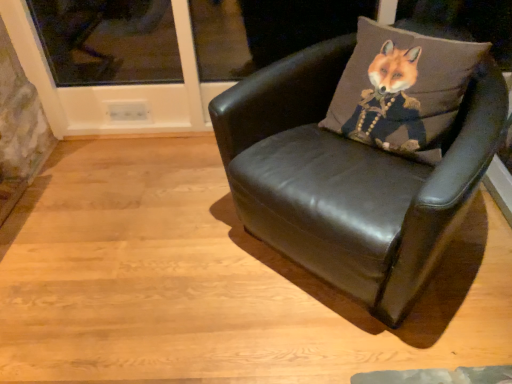
Locate an element on the screen. brown fabric fox at upper right is located at coordinates (402, 88).

The height and width of the screenshot is (384, 512). What do you see at coordinates (402, 88) in the screenshot? I see `brown fabric fox at upper right` at bounding box center [402, 88].

What is the approximate width of brown fabric fox at upper right?

brown fabric fox at upper right is 8.30 inches in width.

From the picture: What is the approximate height of black leather chair at center?

A: black leather chair at center is 27.73 inches tall.

What do you see at coordinates (349, 178) in the screenshot? The width and height of the screenshot is (512, 384). I see `black leather chair at center` at bounding box center [349, 178].

Identify the location of black leather chair at center. (349, 178).

Find the location of a particular element. The height and width of the screenshot is (384, 512). brown fabric fox at upper right is located at coordinates (402, 88).

Is brown fabric fox at upper right to the left or to the right of black leather chair at center in the image?

Clearly, brown fabric fox at upper right is on the right of black leather chair at center in the image.

Considering the positions of objects brown fabric fox at upper right and black leather chair at center in the image provided, who is behind, brown fabric fox at upper right or black leather chair at center?

brown fabric fox at upper right.

Does point (407, 148) come farther from viewer compared to point (218, 145)?

No, it is not.

From the image's perspective, between brown fabric fox at upper right and black leather chair at center, which one is located above?

brown fabric fox at upper right.

From a real-world perspective, which is physically below, brown fabric fox at upper right or black leather chair at center?

From a 3D spatial view, black leather chair at center is below.

Is brown fabric fox at upper right wider or thinner than black leather chair at center?

Clearly, brown fabric fox at upper right has less width compared to black leather chair at center.

Between brown fabric fox at upper right and black leather chair at center, which one has less height?

Standing shorter between the two is brown fabric fox at upper right.

Consider the image. Which of these two, brown fabric fox at upper right or black leather chair at center, is smaller?

brown fabric fox at upper right.

Would you say brown fabric fox at upper right is outside black leather chair at center?

No, brown fabric fox at upper right is not entirely external to black leather chair at center.

Is brown fabric fox at upper right positioned far away from black leather chair at center?

They are positioned close to each other.

Is brown fabric fox at upper right facing towards black leather chair at center?

Yes, brown fabric fox at upper right is turned towards black leather chair at center.

Locate an element on the screen. This screenshot has height=384, width=512. chair lying in front of the brown fabric fox at upper right is located at coordinates (349, 178).

Which object is positioned more to the left, black leather chair at center or brown fabric fox at upper right?

Positioned to the left is black leather chair at center.

From the picture: Relative to brown fabric fox at upper right, is black leather chair at center in front or behind?

Clearly, black leather chair at center is in front of brown fabric fox at upper right.

Does point (362, 284) appear closer or farther from the camera than point (386, 66)?

Point (362, 284) is positioned closer to the camera compared to point (386, 66).

From the image's perspective, is black leather chair at center positioned above or below brown fabric fox at upper right?

black leather chair at center is situated lower than brown fabric fox at upper right in the image.

Consider the image. From a real-world perspective, is black leather chair at center beneath brown fabric fox at upper right?

Yes.

Between black leather chair at center and brown fabric fox at upper right, which one has larger width?

With larger width is black leather chair at center.

Who is shorter, black leather chair at center or brown fabric fox at upper right?

brown fabric fox at upper right.

Considering the sizes of objects black leather chair at center and brown fabric fox at upper right in the image provided, who is bigger, black leather chair at center or brown fabric fox at upper right?

black leather chair at center.

Is brown fabric fox at upper right inside black leather chair at center?

Yes, brown fabric fox at upper right is a part of black leather chair at center.

Would you consider black leather chair at center to be distant from brown fabric fox at upper right?

No, black leather chair at center is not far from brown fabric fox at upper right.

Looking at this image, could you tell me if black leather chair at center is turned towards brown fabric fox at upper right?

No, black leather chair at center is not facing towards brown fabric fox at upper right.

How many degrees apart are the facing directions of black leather chair at center and brown fabric fox at upper right?

There is a 0.00123-degree angle between the facing directions of black leather chair at center and brown fabric fox at upper right.

At what (x,y) coordinates should I click in order to perform the action: click on chair that is in front of the brown fabric fox at upper right. Please return your answer as a coordinate pair (x, y). Image resolution: width=512 pixels, height=384 pixels. Looking at the image, I should click on (349, 178).

Where is `throw pillow that is above the black leather chair at center (from a real-world perspective)`? This screenshot has height=384, width=512. throw pillow that is above the black leather chair at center (from a real-world perspective) is located at coordinates 402,88.

In the image, there is a black leather chair at center. At what (x,y) coordinates should I click in order to perform the action: click on throw pillow above it (from the image's perspective). Please return your answer as a coordinate pair (x, y). Looking at the image, I should click on pyautogui.click(x=402, y=88).